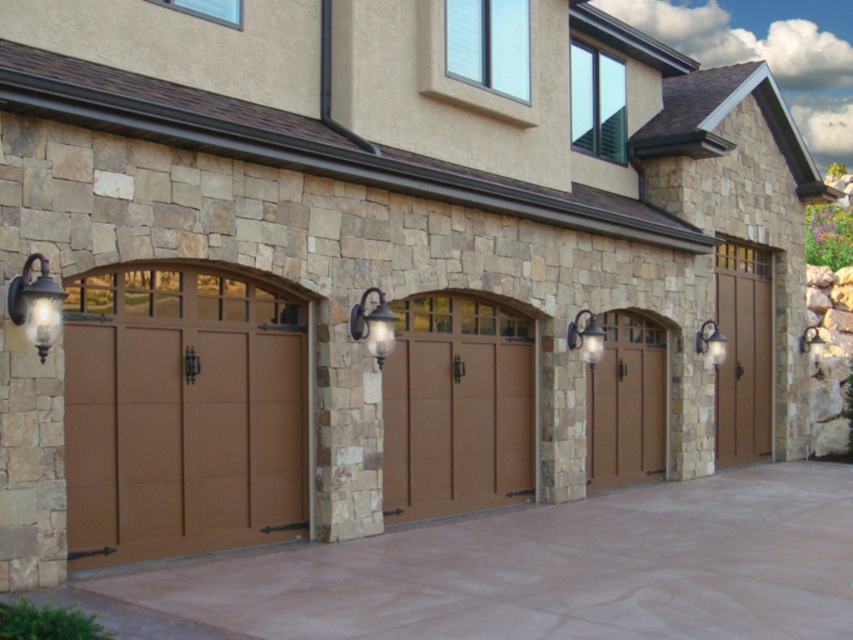
Is brown wood/glass garage door at left to the right of matte brown door at center from the viewer's perspective?

No, brown wood/glass garage door at left is not to the right of matte brown door at center.

Is brown wood/glass garage door at left thinner than matte brown door at center?

Incorrect, brown wood/glass garage door at left's width is not less than matte brown door at center's.

Find the location of `brown wood/glass garage door at left`. brown wood/glass garage door at left is located at coordinates (183, 413).

Consider the image. Can you confirm if matte black sconce at center is positioned to the right of matte black sconce at upper right?

Incorrect, matte black sconce at center is not on the right side of matte black sconce at upper right.

Between point (578, 333) and point (712, 339), which one is positioned in front?

Positioned in front is point (578, 333).

Locate an element on the screen. This screenshot has width=853, height=640. matte black sconce at center is located at coordinates click(x=585, y=337).

Does brown concrete driveway at center have a larger size compared to matte black sconce at center?

Indeed, brown concrete driveway at center has a larger size compared to matte black sconce at center.

Based on the photo, can you confirm if brown concrete driveway at center is positioned to the left of matte black sconce at center?

Yes, brown concrete driveway at center is to the left of matte black sconce at center.

Locate an element on the screen. brown concrete driveway at center is located at coordinates (531, 572).